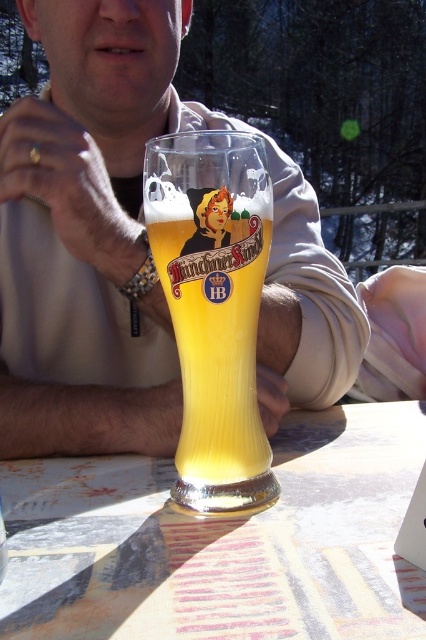
Who is higher up, translucent glass table at center or translucent glass beer glass at center?

translucent glass beer glass at center

Does point (183, 560) come in front of point (253, 240)?

Yes, point (183, 560) is in front of point (253, 240).

The height and width of the screenshot is (640, 426). Describe the element at coordinates (221, 541) in the screenshot. I see `translucent glass table at center` at that location.

The image size is (426, 640). In order to click on translucent glass table at center in this screenshot , I will do `click(221, 541)`.

The width and height of the screenshot is (426, 640). In order to click on matte glass beer at center in this screenshot , I will do `click(89, 234)`.

Does point (264, 358) come in front of point (310, 598)?

No, (264, 358) is behind (310, 598).

At what (x,y) coordinates should I click in order to perform the action: click on matte glass beer at center. Please return your answer as a coordinate pair (x, y). The height and width of the screenshot is (640, 426). Looking at the image, I should click on (89, 234).

Is matte glass beer at center shorter than translucent glass beer glass at center?

In fact, matte glass beer at center may be taller than translucent glass beer glass at center.

Does matte glass beer at center have a greater width compared to translucent glass beer glass at center?

Indeed, matte glass beer at center has a greater width compared to translucent glass beer glass at center.

What do you see at coordinates (89, 234) in the screenshot? I see `matte glass beer at center` at bounding box center [89, 234].

The image size is (426, 640). What are the coordinates of `matte glass beer at center` in the screenshot? It's located at (89, 234).